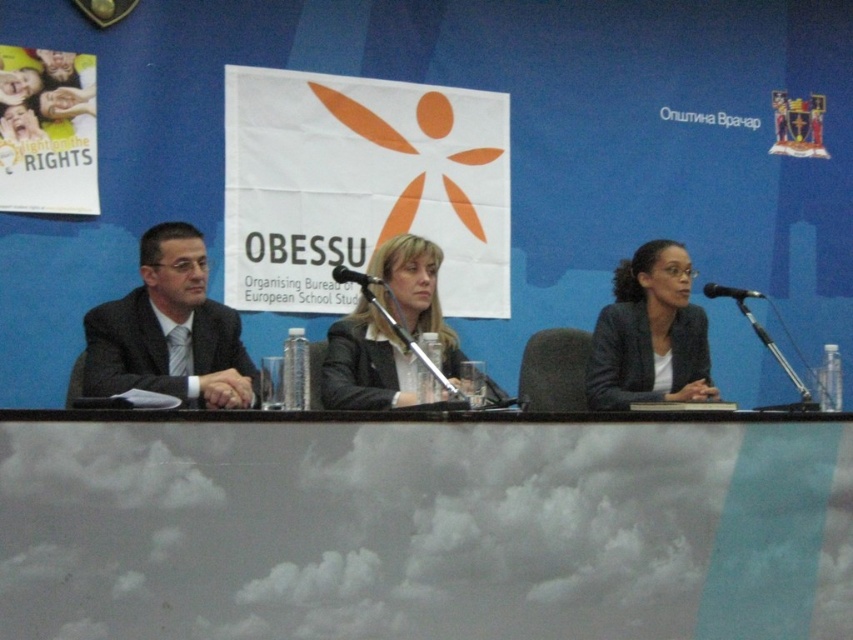
Between matte black blazer at right and black glossy suit at center, which one has more height?

Standing taller between the two is matte black blazer at right.

Is matte black blazer at right thinner than black glossy suit at center?

Indeed, matte black blazer at right has a lesser width compared to black glossy suit at center.

The width and height of the screenshot is (853, 640). I want to click on matte black blazer at right, so click(x=648, y=333).

Does point (172, 260) come in front of point (758, 292)?

Yes, point (172, 260) is in front of point (758, 292).

The width and height of the screenshot is (853, 640). Find the location of `dark suit at left`. dark suit at left is located at coordinates (169, 330).

Between matte black blazer at right and metallic silver microphone at center, which one is positioned higher?

metallic silver microphone at center is above.

Which is more to the right, matte black blazer at right or metallic silver microphone at center?

metallic silver microphone at center is more to the right.

The height and width of the screenshot is (640, 853). I want to click on matte black blazer at right, so click(648, 333).

Identify the location of matte black blazer at right. (648, 333).